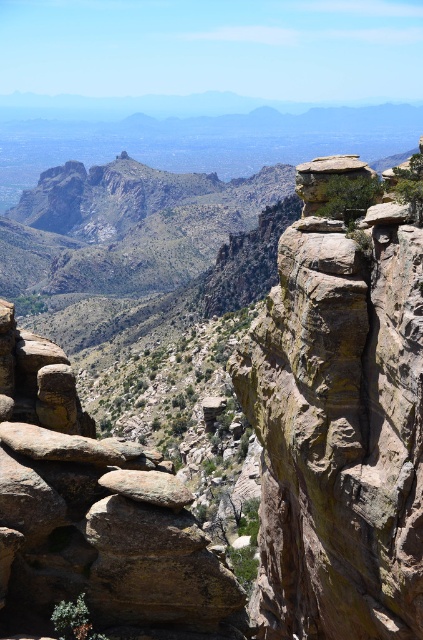
Question: Is rusty brown rock at upper center thinner than rusty rock formation at center?

Choices:
 (A) yes
 (B) no

Answer: (A)

Question: Does rusty brown rock at upper center appear on the left side of rusty rock formation at center?

Choices:
 (A) no
 (B) yes

Answer: (A)

Question: Which of the following is the farthest from the observer?

Choices:
 (A) rusty rock formation at center
 (B) rusty brown rock at upper center

Answer: (A)

Question: Is rusty brown rock at upper center thinner than rusty rock formation at center?

Choices:
 (A) yes
 (B) no

Answer: (A)

Question: Which point is closer to the camera taking this photo?

Choices:
 (A) (293, 337)
 (B) (172, 552)

Answer: (B)